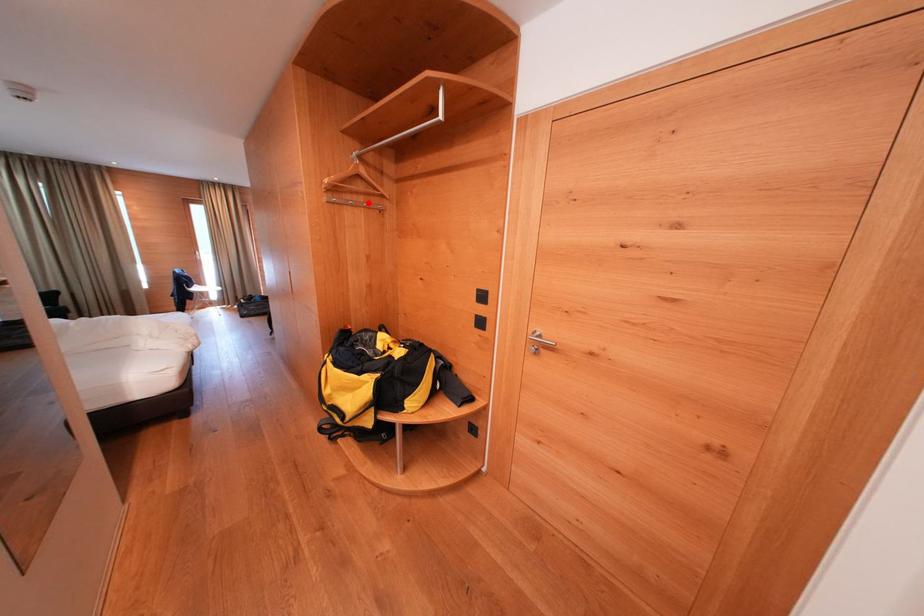
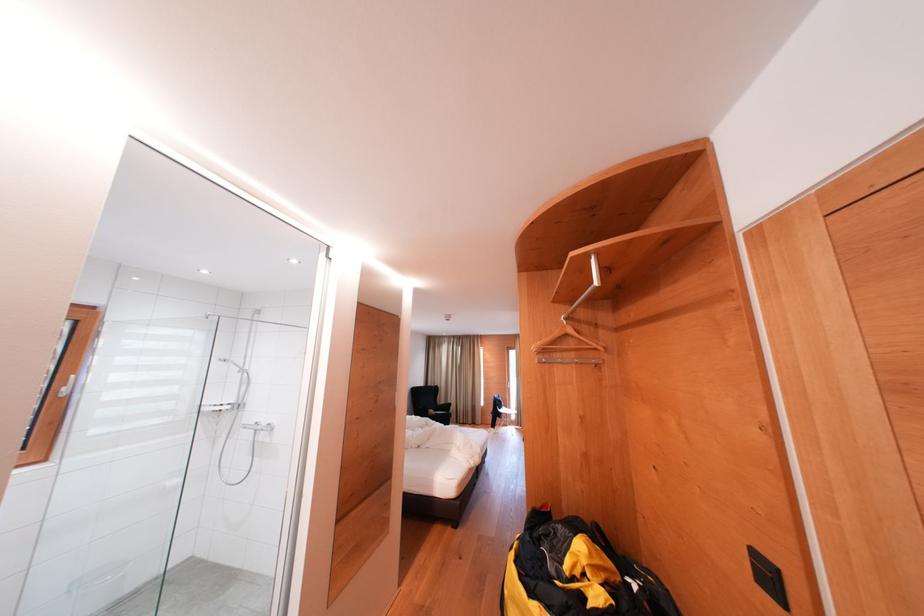
Question: A red point is marked in image1. In image2, is the corresponding 3D point closer to the camera or farther? Reply with the corresponding letter.

Choices:
 (A) The corresponding 3D point is closer.
 (B) The corresponding 3D point is farther.

Answer: (B)